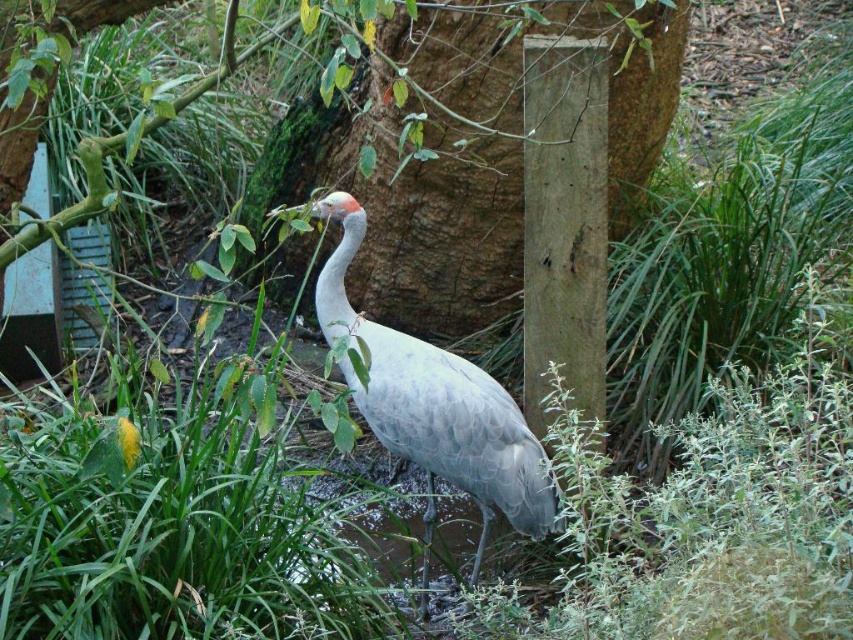
You are standing in the naturalistic setting described and want to walk from the point at coordinates point (514, 90) to the point at coordinates point (426, 524). Which direction should you move to get closer to your destination?

You should move away from the viewer because point (426, 524) is farther away than point (514, 90).

You are a wildlife photographer aiming to capture a closeup of the gray matte bird at center while keeping the brown rough tree trunk at center visible in the background. Given that your camera has a depth of field that can sharply focus on objects within a 4 feet range, will the tree trunk remain in focus when you focus on the bird?

The distance between brown rough tree trunk at center and gray matte bird at center is 4.53 feet. Since the depth of field can only sharply focus within 4 feet, the tree trunk will be slightly out of focus when focusing on the bird.